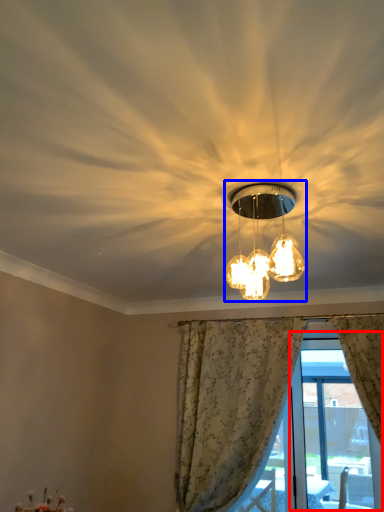
Question: Which point is further to the camera, window screen (highlighted by a red box) or lamp (highlighted by a blue box)?

Choices:
 (A) window screen
 (B) lamp

Answer: (A)